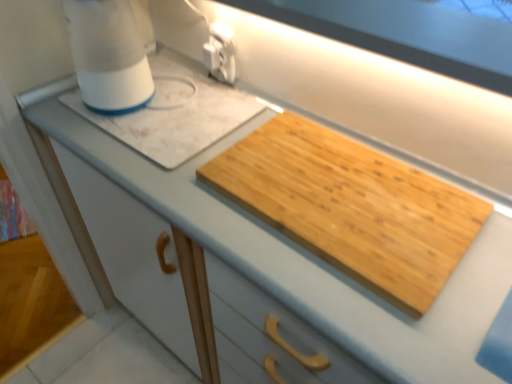
Question: Relative to white plastic blender at upper left, is natural wood cutting board at center in front or behind?

Choices:
 (A) behind
 (B) front

Answer: (B)

Question: From the image's perspective, is natural wood cutting board at center above or below white plastic blender at upper left?

Choices:
 (A) below
 (B) above

Answer: (A)

Question: Based on their relative distances, which object is nearer to the white plastic blender at upper left?

Choices:
 (A) white plastic electric outlet at upper center
 (B) natural wood cutting board at center

Answer: (A)

Question: Estimate the real-world distances between objects in this image. Which object is farther from the white plastic electric outlet at upper center?

Choices:
 (A) natural wood cutting board at center
 (B) white plastic blender at upper left

Answer: (A)